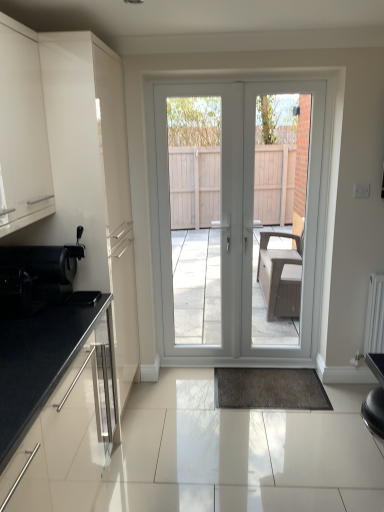
The height and width of the screenshot is (512, 384). I want to click on free space above white glossy door at center, the first screen door viewed from the left (from a real-world perspective), so click(x=197, y=82).